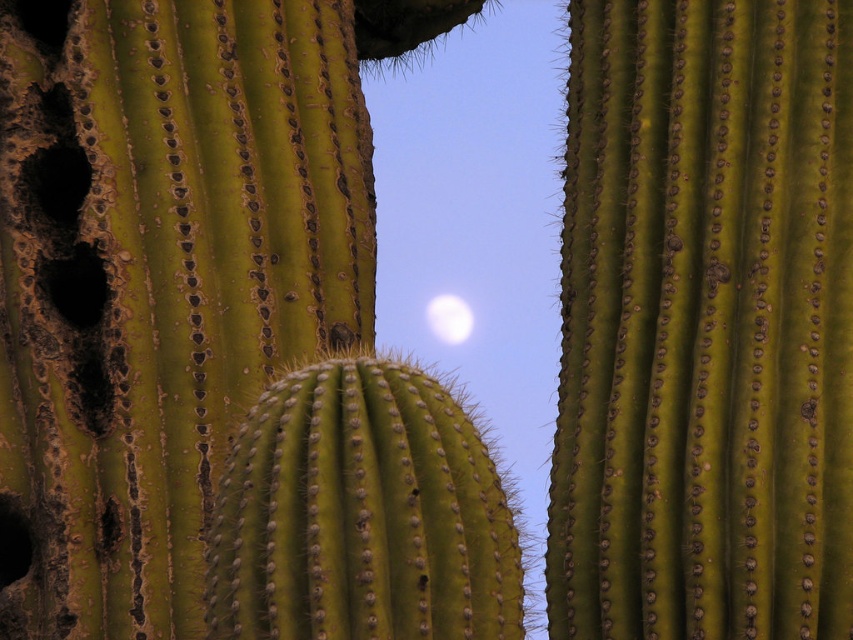
Question: Is green spiny cactus at center thinner than white translucent moon at upper center?

Choices:
 (A) no
 (B) yes

Answer: (A)

Question: Can you confirm if green spiny cactus at center is smaller than white translucent moon at upper center?

Choices:
 (A) yes
 (B) no

Answer: (B)

Question: Does green spiny cactus at center appear on the left side of white translucent moon at upper center?

Choices:
 (A) no
 (B) yes

Answer: (A)

Question: Which of the following is the farthest from the observer?

Choices:
 (A) (233, 557)
 (B) (444, 314)

Answer: (B)

Question: Which of the following is the farthest from the observer?

Choices:
 (A) (461, 339)
 (B) (445, 598)

Answer: (A)

Question: Among these points, which one is nearest to the camera?

Choices:
 (A) (439, 320)
 (B) (363, 609)

Answer: (B)